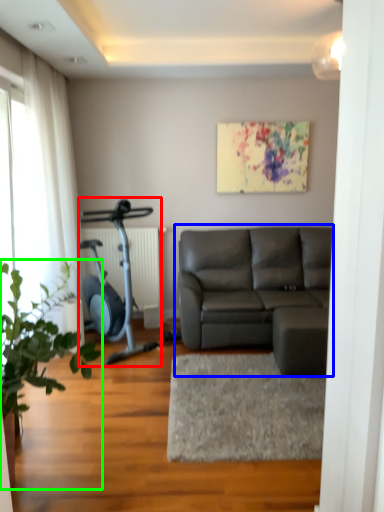
Question: Considering the real-world distances, which object is closest to stationary bicycle (highlighted by a red box)? studio couch (highlighted by a blue box) or houseplant (highlighted by a green box).

Choices:
 (A) studio couch
 (B) houseplant

Answer: (A)